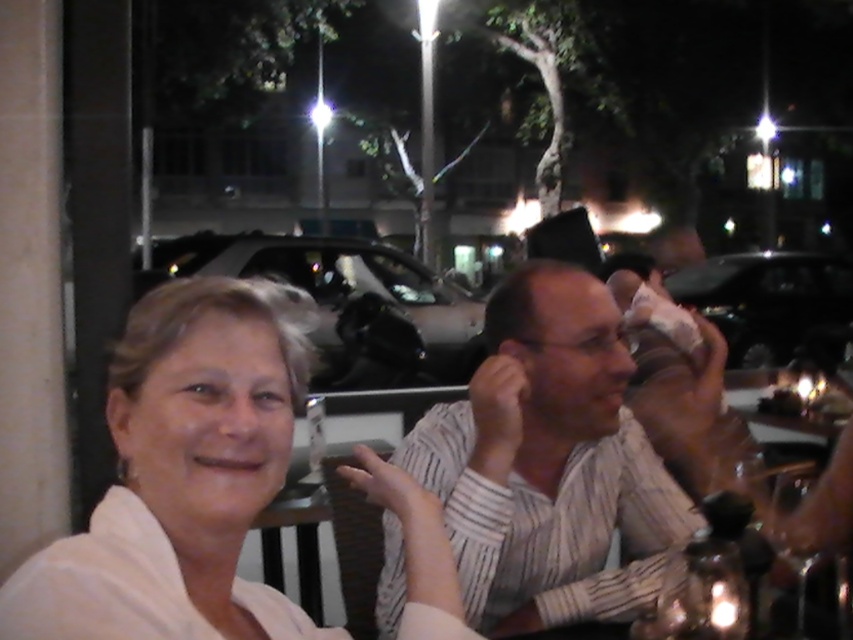
You are standing at the center of the image and want to reach the white matte shirt at center located at point (183, 474). Is the path clear of any obstacles between your current position and the shirt?

The path between your current position and the white matte shirt at center is clear of any obstacles as there are no objects mentioned in the scene description blocking the way.

You are a photographer trying to capture a group photo of the two people at the table. Since the white matte shirt at center and the striped shirt at center are both in the frame, which person should you ask to move closer to the other to ensure both are clearly visible in the photo?

The white matte shirt at center should move closer to the striped shirt at center because the white matte shirt at center is narrower in width than the striped shirt at center, allowing them to adjust their positions for better visibility.

You are standing in the nighttime outdoor scene and want to walk from the point closer to you to the point farther away. Which path would you take between the two points, point (x=161, y=326) and point (x=508, y=310)?

The path from point (x=161, y=326) to point (x=508, y=310) would require moving towards the background since point (x=161, y=326) is closer to the viewer and point (x=508, y=310) is farther away.